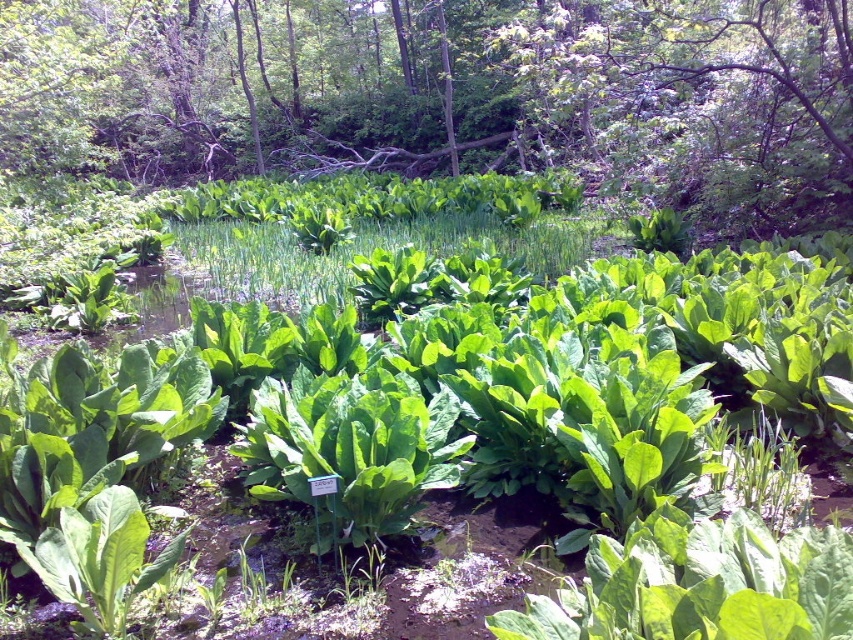
You are a gardener who wants to harvest the tallest plant in the garden. You see the green leafy plant at center and the green leafy grass at center. Which one should you pick?

The green leafy plant at center is much taller than the green leafy grass at center, so you should pick the green leafy plant at center.